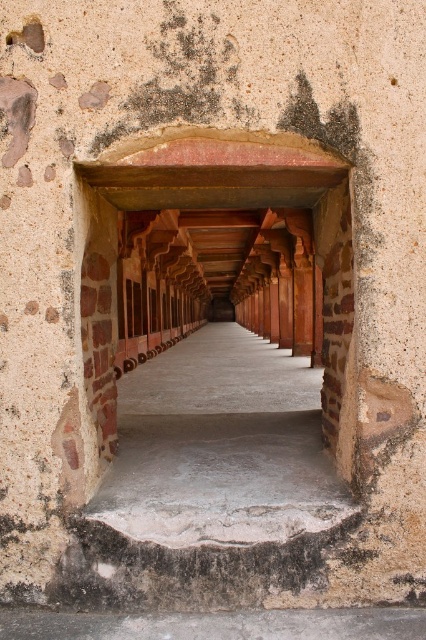
You are standing at the entrance of the corridor under the stone archway. You notice a specific point marked at coordinates (221, 445). Based on the scene description, what type of surface does this point most likely lie on?

The point at (221, 445) corresponds to the smooth concrete corridor at center, so it lies on a smooth concrete surface.

You are standing in the corridor and want to exit through the rusty metal hole at upper left. Which direction should you move relative to the smooth concrete corridor at center?

To exit through the rusty metal hole at upper left, you should move to the left of the smooth concrete corridor at center since the smooth concrete corridor at center is to the right of the rusty metal hole at upper left.

You are standing in the corridor and want to walk towards the point labeled point (37,33). Which direction should you move relative to the point labeled point (186,476)?

Since point (186,476) is further to the camera than point (37,33), you should move towards the direction away from point (186,476) to reach point (37,33).